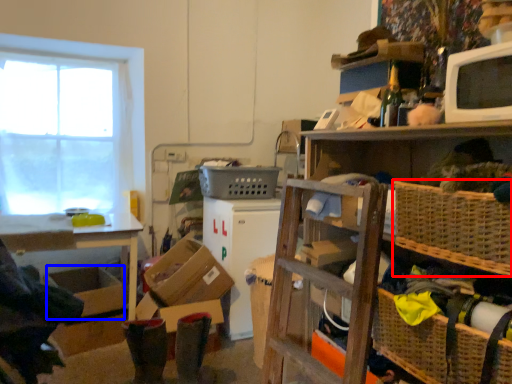
Question: Which of the following is the closest to the observer, basket (highlighted by a red box) or storage box (highlighted by a blue box)?

Choices:
 (A) basket
 (B) storage box

Answer: (A)